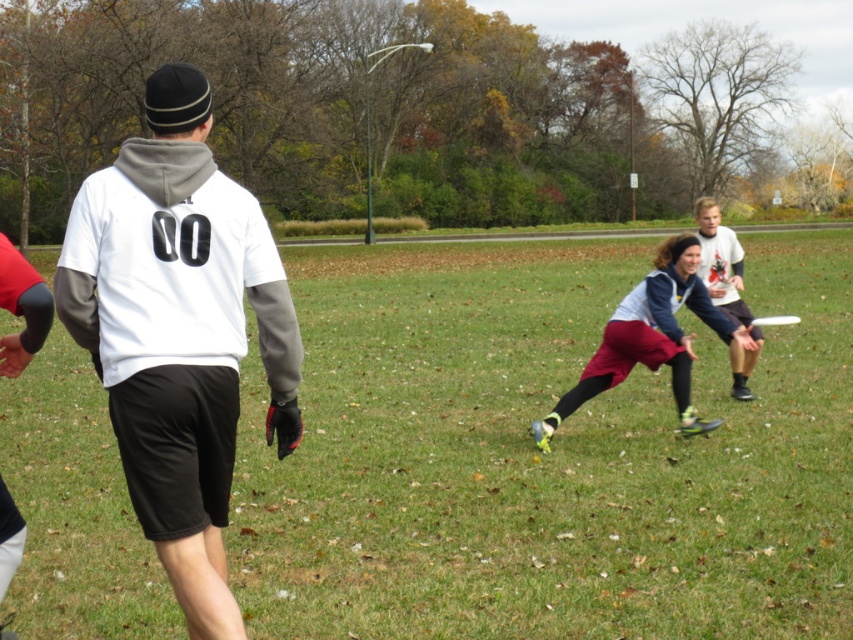
Is white matte hoodie at center thinner than maroon fabric pants at center?

Yes, white matte hoodie at center is thinner than maroon fabric pants at center.

Is white matte hoodie at center closer to the viewer compared to maroon fabric pants at center?

Yes, white matte hoodie at center is closer to the viewer.

This screenshot has width=853, height=640. In order to click on white matte hoodie at center in this screenshot , I will do tap(178, 332).

I want to click on white matte hoodie at center, so click(x=178, y=332).

The image size is (853, 640). What are the coordinates of `maroon fabric pants at center` in the screenshot? It's located at (651, 337).

Image resolution: width=853 pixels, height=640 pixels. What do you see at coordinates (651, 337) in the screenshot?
I see `maroon fabric pants at center` at bounding box center [651, 337].

Does point (689, 358) come farther from viewer compared to point (755, 323)?

No.

Locate an element on the screen. The width and height of the screenshot is (853, 640). maroon fabric pants at center is located at coordinates (651, 337).

Is green grass at center wider than white plastic frisbee at center?

Yes.

Who is more forward, (x=462, y=403) or (x=788, y=321)?

Positioned in front is point (x=462, y=403).

Identify the location of green grass at center. (544, 454).